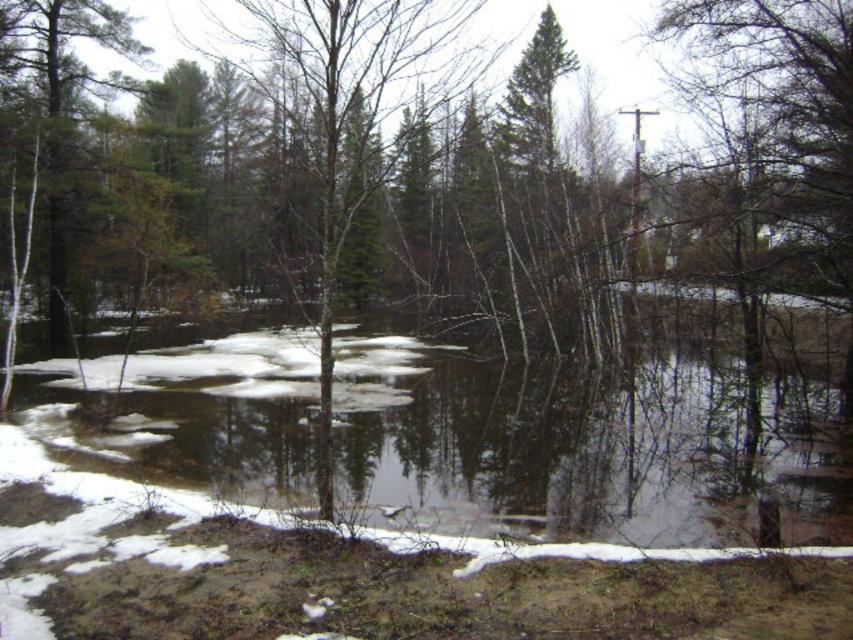
Is brown/reflective water at center wider than green matte tree at center?

Indeed, brown/reflective water at center has a greater width compared to green matte tree at center.

Which of these two, brown/reflective water at center or green matte tree at center, stands shorter?

With less height is brown/reflective water at center.

What do you see at coordinates (581, 449) in the screenshot? This screenshot has width=853, height=640. I see `brown/reflective water at center` at bounding box center [581, 449].

The width and height of the screenshot is (853, 640). Find the location of `brown/reflective water at center`. brown/reflective water at center is located at coordinates (581, 449).